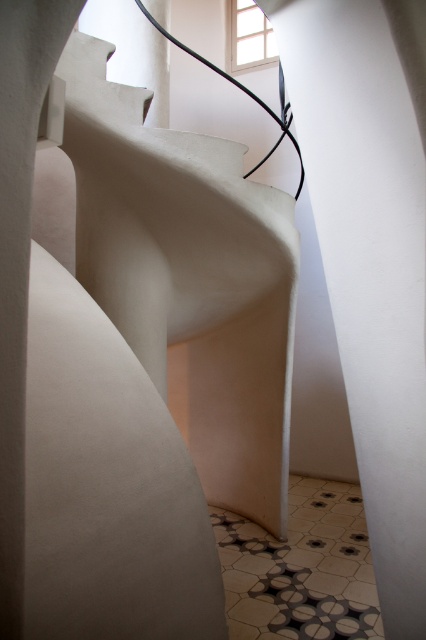
Question: Among these points, which one is farthest from the camera?

Choices:
 (A) (374, 388)
 (B) (282, 348)

Answer: (B)

Question: Can you confirm if white matte staircase at center is positioned above white matte wall at center?

Choices:
 (A) no
 (B) yes

Answer: (B)

Question: Can you confirm if white matte staircase at center is wider than white matte wall at center?

Choices:
 (A) no
 (B) yes

Answer: (B)

Question: Can you confirm if white matte staircase at center is positioned below white matte wall at center?

Choices:
 (A) yes
 (B) no

Answer: (B)

Question: Which point appears closest to the camera in this image?

Choices:
 (A) pos(244,275)
 (B) pos(324,157)

Answer: (B)